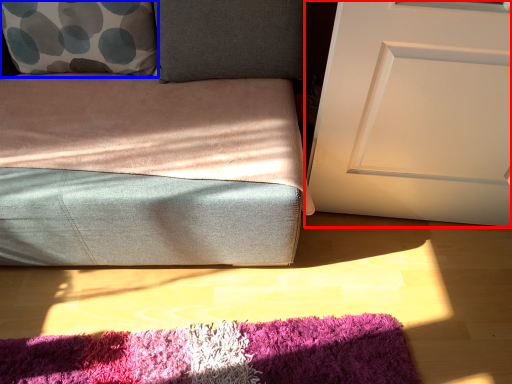
Question: Which object is further to the camera taking this photo, door (highlighted by a red box) or throw pillow (highlighted by a blue box)?

Choices:
 (A) door
 (B) throw pillow

Answer: (B)